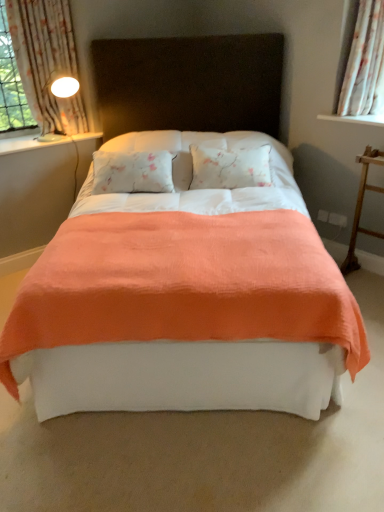
What do you see at coordinates (361, 207) in the screenshot? I see `wooden ladder at right` at bounding box center [361, 207].

The height and width of the screenshot is (512, 384). What do you see at coordinates (185, 261) in the screenshot? I see `coral fabric bed at center` at bounding box center [185, 261].

Where is `floral fabric curtain at left, which is counted as the first curtain, starting from the left`? The image size is (384, 512). floral fabric curtain at left, which is counted as the first curtain, starting from the left is located at coordinates (46, 61).

Measure the distance between white floral fabric curtain at upper right, which is the second curtain from left to right, and camera.

white floral fabric curtain at upper right, which is the second curtain from left to right, and camera are 8.52 feet apart.

Locate an element on the screen. Image resolution: width=384 pixels, height=512 pixels. white glossy window sill at left is located at coordinates (41, 142).

You are a GUI agent. You are given a task and a screenshot of the screen. Output one action in this format:
    pyautogui.click(x=<x>, y=<y>)
    Task: Click on the wooden ladder at right
    Image resolution: width=384 pixels, height=512 pixels.
    Given the screenshot: What is the action you would take?
    [361, 207]

How many degrees apart are the facing directions of white floral fabric curtain at upper right, which is the first curtain in right-to-left order, and floral fabric curtain at left, which is counted as the second curtain, starting from the right?

The facing directions of white floral fabric curtain at upper right, which is the first curtain in right-to-left order, and floral fabric curtain at left, which is counted as the second curtain, starting from the right, are 90 degrees apart.

Are white floral fabric curtain at upper right, which is the second curtain from left to right, and floral fabric curtain at left, which is counted as the first curtain, starting from the left, far apart?

Yes, white floral fabric curtain at upper right, which is the second curtain from left to right, and floral fabric curtain at left, which is counted as the first curtain, starting from the left, are quite far apart.

From a real-world perspective, who is located lower, white floral fabric curtain at upper right, which is the second curtain from left to right, or floral fabric curtain at left, which is counted as the first curtain, starting from the left?

From a 3D spatial view, floral fabric curtain at left, which is counted as the first curtain, starting from the left, is below.

Does white glossy lamp at upper left have a larger size compared to floral fabric curtain at left, which is counted as the second curtain, starting from the right?

Actually, white glossy lamp at upper left might be smaller than floral fabric curtain at left, which is counted as the second curtain, starting from the right.

Would you say white glossy lamp at upper left is to the left or to the right of floral fabric curtain at left, which is counted as the second curtain, starting from the right, in the picture?

From the image, it's evident that white glossy lamp at upper left is to the right of floral fabric curtain at left, which is counted as the second curtain, starting from the right.

Is floral fabric curtain at left, which is counted as the first curtain, starting from the left, at the back of white glossy lamp at upper left?

Yes, white glossy lamp at upper left is facing away from floral fabric curtain at left, which is counted as the first curtain, starting from the left.

Between point (60, 115) and point (71, 59), which one is positioned in front?

The point (71, 59) is closer to the camera.

The height and width of the screenshot is (512, 384). In order to click on side table that appears in front of the white floral fabric curtain at upper right, which is the first curtain in right-to-left order in this screenshot , I will do `click(361, 207)`.

Which object is thinner, wooden ladder at right or white floral fabric curtain at upper right, which is the first curtain in right-to-left order?

With smaller width is white floral fabric curtain at upper right, which is the first curtain in right-to-left order.

Is wooden ladder at right located outside white floral fabric curtain at upper right, which is the second curtain from left to right?

Yes.

How many degrees apart are the facing directions of white glossy window sill at left and white floral fabric curtain at upper right, which is the second curtain from left to right?

There is a 90-degree angle between the facing directions of white glossy window sill at left and white floral fabric curtain at upper right, which is the second curtain from left to right.

Based on the photo, is white glossy window sill at left spatially inside white floral fabric curtain at upper right, which is the first curtain in right-to-left order, or outside of it?

white glossy window sill at left is not enclosed by white floral fabric curtain at upper right, which is the first curtain in right-to-left order.

Starting from the white glossy window sill at left, which curtain is the 2nd one to the right? Please provide its 2D coordinates.

[(365, 64)]

Is white glossy window sill at left far away from white floral fabric curtain at upper right, which is the second curtain from left to right?

Yes, white glossy window sill at left is far from white floral fabric curtain at upper right, which is the second curtain from left to right.

Is white glossy lamp at upper left oriented towards white floral fabric curtain at upper right, which is the first curtain in right-to-left order?

No, white glossy lamp at upper left is not facing towards white floral fabric curtain at upper right, which is the first curtain in right-to-left order.

Does white glossy lamp at upper left have a lesser height compared to white floral fabric curtain at upper right, which is the second curtain from left to right?

Yes, white glossy lamp at upper left is shorter than white floral fabric curtain at upper right, which is the second curtain from left to right.

Is white glossy lamp at upper left inside the boundaries of white floral fabric curtain at upper right, which is the second curtain from left to right, or outside?

white glossy lamp at upper left is not inside white floral fabric curtain at upper right, which is the second curtain from left to right, it's outside.

Which object is wider, white glossy lamp at upper left or white floral fabric curtain at upper right, which is the second curtain from left to right?

With larger width is white glossy lamp at upper left.

Between coral fabric bed at center and white glossy lamp at upper left, which one has larger width?

coral fabric bed at center is wider.

From a real-world perspective, who is located lower, coral fabric bed at center or white glossy lamp at upper left?

coral fabric bed at center.

From a real-world perspective, relative to white glossy window sill at left, is white glossy lamp at upper left vertically above or below?

In terms of real-world spatial position, white glossy lamp at upper left is above white glossy window sill at left.

Could you tell me if white glossy lamp at upper left is turned towards white glossy window sill at left?

No.

Find the location of a particular element. curtain above the floral fabric curtain at left, which is counted as the first curtain, starting from the left (from a real-world perspective) is located at coordinates (365, 64).

Image resolution: width=384 pixels, height=512 pixels. In order to click on light fixture behind the floral fabric curtain at left, which is counted as the second curtain, starting from the right in this screenshot , I will do `click(64, 93)`.

Looking at the image, which one is located closer to white floral fabric curtain at upper right, which is the first curtain in right-to-left order, wooden ladder at right or white glossy lamp at upper left?

wooden ladder at right lies closer to white floral fabric curtain at upper right, which is the first curtain in right-to-left order, than the other object.

Considering their positions, is wooden ladder at right positioned further to floral fabric curtain at left, which is counted as the second curtain, starting from the right, than white glossy window sill at left?

Based on the image, wooden ladder at right appears to be further to floral fabric curtain at left, which is counted as the second curtain, starting from the right.

Estimate the real-world distances between objects in this image. Which object is closer to floral fabric curtain at left, which is counted as the second curtain, starting from the right, white glossy lamp at upper left or white floral fabric curtain at upper right, which is the second curtain from left to right?

Among the two, white glossy lamp at upper left is located nearer to floral fabric curtain at left, which is counted as the second curtain, starting from the right.

When comparing their distances from coral fabric bed at center, does wooden ladder at right or floral fabric curtain at left, which is counted as the second curtain, starting from the right, seem closer?

wooden ladder at right is closer to coral fabric bed at center.

Which object lies further to the anchor point white floral fabric curtain at upper right, which is the first curtain in right-to-left order, white glossy window sill at left or white glossy lamp at upper left?

white glossy lamp at upper left is positioned further to the anchor white floral fabric curtain at upper right, which is the first curtain in right-to-left order.

Estimate the real-world distances between objects in this image. Which object is further from white glossy window sill at left, coral fabric bed at center or white floral fabric curtain at upper right, which is the second curtain from left to right?

white floral fabric curtain at upper right, which is the second curtain from left to right, is positioned further to the anchor white glossy window sill at left.

When comparing their distances from coral fabric bed at center, does floral fabric curtain at left, which is counted as the second curtain, starting from the right, or wooden ladder at right seem further?

floral fabric curtain at left, which is counted as the second curtain, starting from the right, is positioned further to the anchor coral fabric bed at center.

Which object lies nearer to the anchor point white glossy lamp at upper left, white glossy window sill at left or wooden ladder at right?

Based on the image, white glossy window sill at left appears to be nearer to white glossy lamp at upper left.

Where is `bed situated between floral fabric curtain at left, which is counted as the first curtain, starting from the left, and white floral fabric curtain at upper right, which is the first curtain in right-to-left order, from left to right`? The image size is (384, 512). bed situated between floral fabric curtain at left, which is counted as the first curtain, starting from the left, and white floral fabric curtain at upper right, which is the first curtain in right-to-left order, from left to right is located at coordinates (185, 261).

Locate an element on the screen. The width and height of the screenshot is (384, 512). bed between white glossy window sill at left and white floral fabric curtain at upper right, which is the first curtain in right-to-left order is located at coordinates (185, 261).

At what (x,y) coordinates should I click in order to perform the action: click on curtain located between white glossy window sill at left and white floral fabric curtain at upper right, which is the first curtain in right-to-left order, in the left-right direction. Please return your answer as a coordinate pair (x, y). Looking at the image, I should click on (46, 61).

You are a GUI agent. You are given a task and a screenshot of the screen. Output one action in this format:
    pyautogui.click(x=<x>, y=<y>)
    Task: Click on the curtain located between coral fabric bed at center and wooden ladder at right in the left-right direction
    This screenshot has width=384, height=512.
    Given the screenshot: What is the action you would take?
    [365, 64]